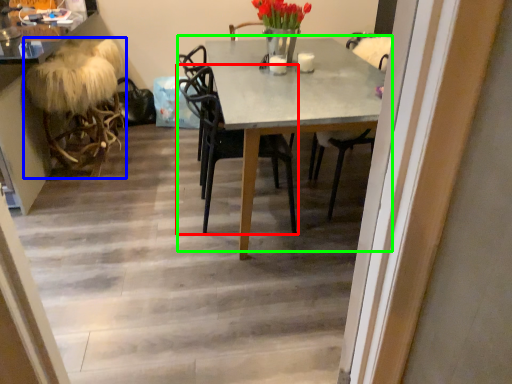
Question: Which is nearer to the chair (highlighted by a red box)? rocking chair (highlighted by a blue box) or kitchen & dining room table (highlighted by a green box).

Choices:
 (A) rocking chair
 (B) kitchen & dining room table

Answer: (B)